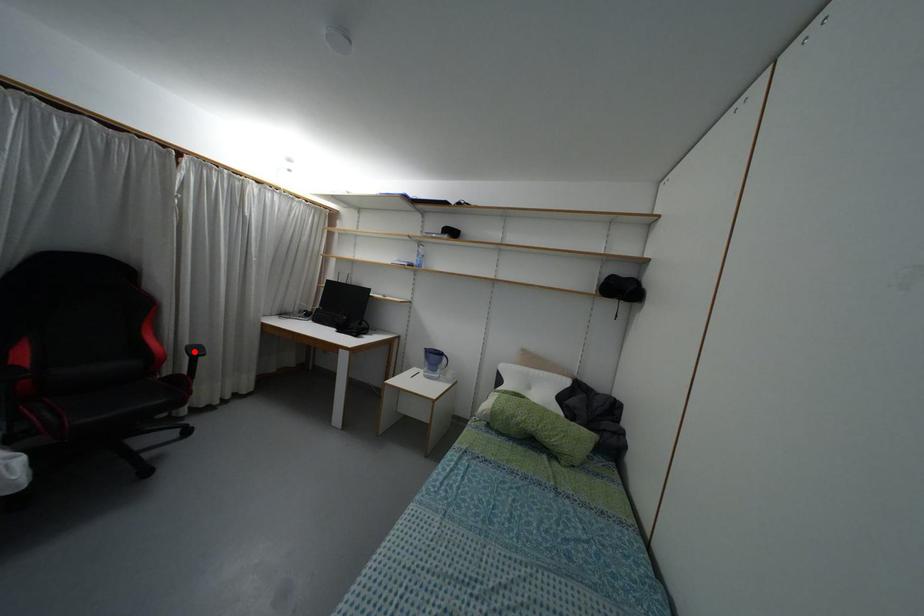
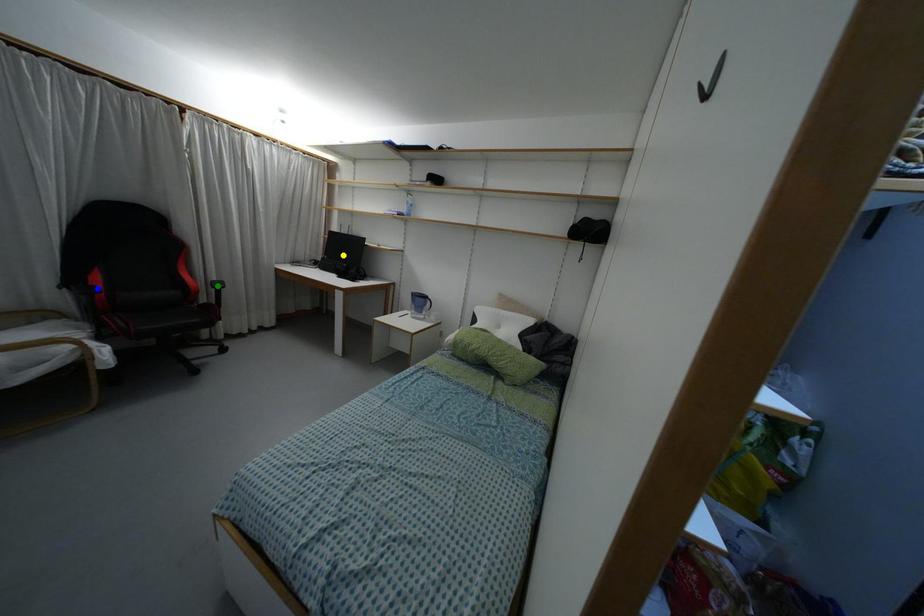
Question: I am providing you with two images of the same scene from different viewpoints. A red point is marked on the first image. You are given multiple points on the second image. Which spot in image 2 lines up with the point in image 1?

Choices:
 (A) blue point
 (B) green point
 (C) yellow point

Answer: (B)